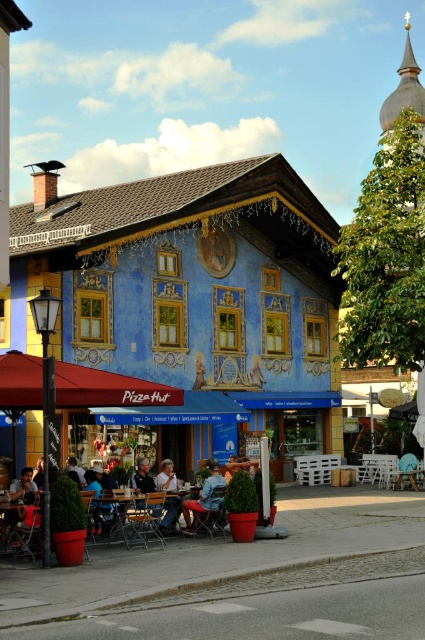
You are a customer at the Pizza Hut restaurant and want to choose a jacket to wear for a short walk. You prefer a jacket that is not too bulky. Which jacket between the denim jacket at lower center and the light brown leather jacket at lower center would you choose and why?

The light brown leather jacket at lower center is smaller in size compared to the denim jacket at lower center, so it would be less bulky and more suitable for a short walk.

You are standing at the point with coordinates (107, 388) in the image. What object are you standing on?

The point (107, 388) corresponds to the red fabric umbrella at lower left.